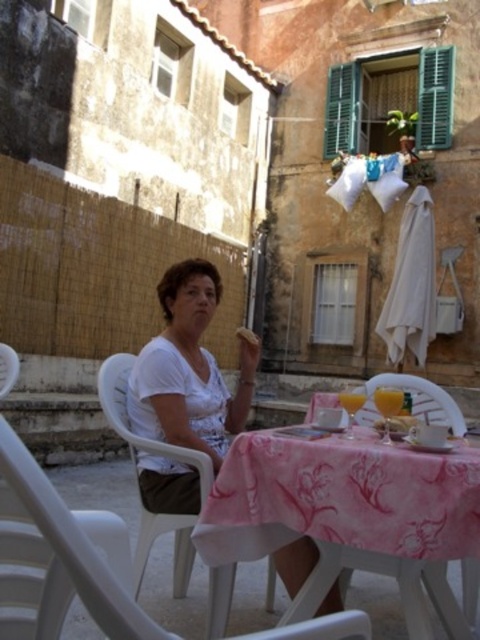
Does white matte shirt at center come behind white plastic chair at center?

Yes, it is.

Can you confirm if white matte shirt at center is wider than white plastic chair at center?

Yes.

Is point (202, 365) closer to viewer compared to point (202, 474)?

No.

This screenshot has height=640, width=480. What are the coordinates of `white matte shirt at center` in the screenshot? It's located at (189, 369).

Is pink floral tablecloth at center closer to the viewer compared to white plastic chair at center?

That is True.

Can you confirm if pink floral tablecloth at center is positioned to the right of white plastic chair at center?

Indeed, pink floral tablecloth at center is positioned on the right side of white plastic chair at center.

Does point (476, 465) come behind point (154, 534)?

No, it is not.

Find the location of a particular element. pink floral tablecloth at center is located at coordinates (336, 502).

Which is behind, point (383, 404) or point (375, 420)?

The point (375, 420) is more distant.

Does translucent glass juice at table center have a greater height compared to smooth yellow bread at table center?

Indeed, translucent glass juice at table center has a greater height compared to smooth yellow bread at table center.

Locate an element on the screen. Image resolution: width=480 pixels, height=640 pixels. translucent glass juice at table center is located at coordinates (387, 401).